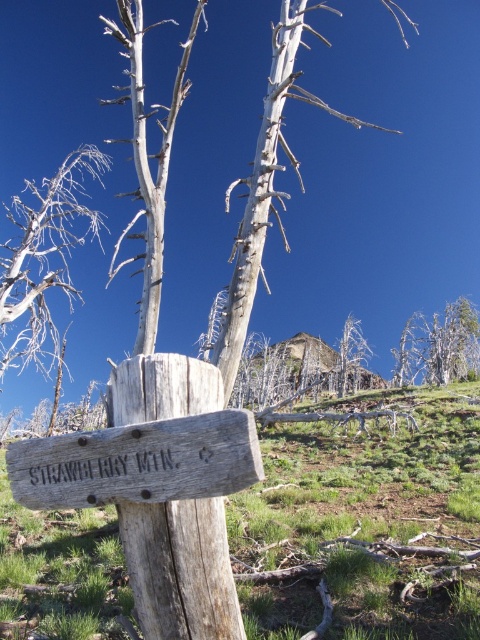
From the picture: You are a hiker who wants to take a photo of the weathered wood sign at center and the gray wood tree at left. Which object should you focus on first to ensure both are in the frame?

You should focus on the weathered wood sign at center first because it is closer to you than the gray wood tree at left, ensuring both are in the frame.

You are a hiker who wants to take a photo of the wooden signpost in the foreground and the dead wood tree at center located at point (x=265, y=186). Can you frame both subjects in your camera viewfinder without moving your position?

Yes, you can frame both the wooden signpost in the foreground and the dead wood tree at center located at point (x=265, y=186) in your camera viewfinder without moving your position since the dead wood tree at center is positioned at the specified coordinates, allowing them to be captured together in the same frame.